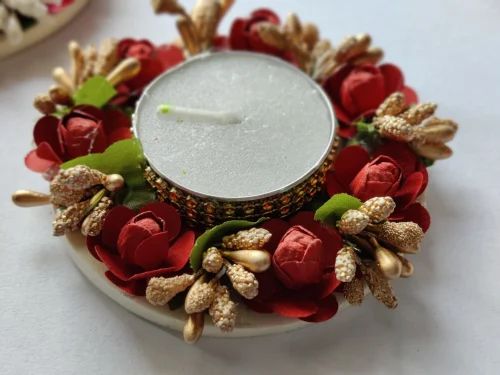
Identify the location of rim of candle holder. [331, 139].